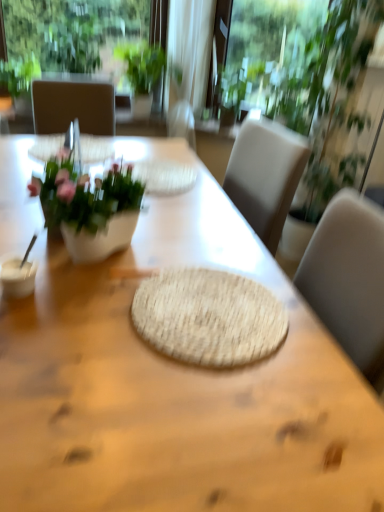
I want to click on natural woven placemat at center, so click(x=175, y=384).

The image size is (384, 512). What do you see at coordinates (85, 195) in the screenshot?
I see `white glossy vase at left` at bounding box center [85, 195].

Describe the element at coordinates (208, 317) in the screenshot. This screenshot has width=384, height=512. I see `natural woven mat at center` at that location.

Locate an element on the screen. This screenshot has width=384, height=512. transparent glass window screen at upper center is located at coordinates (270, 60).

What is the approximate width of green leafy plant at upper left, which ranks as the 3th houseplant in right-to-left order?

It is 14.29 inches.

What do you see at coordinates (146, 66) in the screenshot?
I see `green leafy plant at upper center, acting as the second houseplant starting from the left` at bounding box center [146, 66].

This screenshot has width=384, height=512. In order to click on green leafy plant at upper center, which is the second houseplant from right to left in this screenshot , I will do `click(146, 66)`.

The image size is (384, 512). I want to click on transparent glass window at upper center, so click(73, 33).

Can we say natural woven placemat at center lies outside natural woven mat at center?

Yes, natural woven placemat at center is outside of natural woven mat at center.

Where is `mat above the natural woven placemat at center (from the image's perspective)`? The width and height of the screenshot is (384, 512). mat above the natural woven placemat at center (from the image's perspective) is located at coordinates (208, 317).

Considering the sizes of natural woven placemat at center and natural woven mat at center in the image, is natural woven placemat at center bigger or smaller than natural woven mat at center?

In the image, natural woven placemat at center appears to be larger than natural woven mat at center.

Looking at this image, how many degrees apart are the facing directions of natural woven mat at center and green leafy plant at upper left, arranged as the first houseplant when viewed from the left?

90 degrees separate the facing orientations of natural woven mat at center and green leafy plant at upper left, arranged as the first houseplant when viewed from the left.

Considering the sizes of objects natural woven mat at center and green leafy plant at upper left, arranged as the first houseplant when viewed from the left, in the image provided, who is bigger, natural woven mat at center or green leafy plant at upper left, arranged as the first houseplant when viewed from the left,?

green leafy plant at upper left, arranged as the first houseplant when viewed from the left.

Based on the photo, are natural woven mat at center and green leafy plant at upper left, arranged as the first houseplant when viewed from the left, located far from each other?

Absolutely, natural woven mat at center is distant from green leafy plant at upper left, arranged as the first houseplant when viewed from the left.

Does point (151, 319) come in front of point (26, 63)?

That is True.

From the image's perspective, is transparent glass window at upper center on top of natural woven mat at center?

Yes.

Locate an element on the screen. window lying behind the natural woven mat at center is located at coordinates (73, 33).

Can you confirm if transparent glass window at upper center is smaller than natural woven mat at center?

Incorrect, transparent glass window at upper center is not smaller in size than natural woven mat at center.

Does point (47, 66) come farther from viewer compared to point (182, 322)?

Yes, it is behind point (182, 322).

I want to click on table in front of the transparent glass window screen at upper center, so click(x=175, y=384).

From the image's perspective, would you say transparent glass window screen at upper center is positioned over natural woven placemat at center?

Indeed, from the image's perspective, transparent glass window screen at upper center is shown above natural woven placemat at center.

Is point (288, 18) less distant than point (340, 360)?

No, it is not.

Who is smaller, transparent glass window screen at upper center or natural woven placemat at center?

transparent glass window screen at upper center.

Considering the sizes of transparent glass window at upper center and green leafy plant at upper center, which is the second houseplant from right to left, in the image, is transparent glass window at upper center bigger or smaller than green leafy plant at upper center, which is the second houseplant from right to left,?

transparent glass window at upper center is smaller than green leafy plant at upper center, which is the second houseplant from right to left.

From a real-world perspective, is transparent glass window at upper center on green leafy plant at upper center, acting as the second houseplant starting from the left?

Yes, from a real-world perspective, transparent glass window at upper center is above green leafy plant at upper center, acting as the second houseplant starting from the left.

From the image's perspective, is transparent glass window at upper center on green leafy plant at upper center, which is the second houseplant from right to left?

Yes, from the image's perspective, transparent glass window at upper center is over green leafy plant at upper center, which is the second houseplant from right to left.

Considering the positions of points (8, 57) and (127, 63), is point (8, 57) farther from camera compared to point (127, 63)?

No, it is not.

From the image's perspective, does green leafy plant at upper center, which is the second houseplant from right to left, appear lower than natural woven placemat at center?

No.

Locate an element on the screen. This screenshot has height=512, width=384. the 3rd houseplant behind the natural woven placemat at center, starting your count from the anchor is located at coordinates (146, 66).

What's the angular difference between green leafy plant at upper center, acting as the second houseplant starting from the left, and natural woven placemat at center's facing directions?

The angle between the facing direction of green leafy plant at upper center, acting as the second houseplant starting from the left, and the facing direction of natural woven placemat at center is 94.9 degrees.

Between transparent glass window screen at upper center and white glossy vase at left, which one has less height?

With less height is white glossy vase at left.

Is transparent glass window screen at upper center not inside white glossy vase at left?

Yes, transparent glass window screen at upper center is not within white glossy vase at left.

At what (x,y) coordinates should I click in order to perform the action: click on window screen on the right of white glossy vase at left. Please return your answer as a coordinate pair (x, y). Looking at the image, I should click on (270, 60).

Find the location of `mat that is on the left side of natural woven placemat at center`. mat that is on the left side of natural woven placemat at center is located at coordinates (208, 317).

The image size is (384, 512). Identify the location of houseplant that is the 1st object above the natural woven mat at center (from a real-world perspective). (19, 76).

From the image, which object appears to be farther from white glossy vase at left, green leafy plant at upper center, acting as the second houseplant starting from the left, or transparent glass window at upper center?

green leafy plant at upper center, acting as the second houseplant starting from the left, is further to white glossy vase at left.

Which object lies nearer to the anchor point green leafy plant at upper left, arranged as the first houseplant when viewed from the left, transparent glass window screen at upper center or white glossy vase at left?

transparent glass window screen at upper center.

Considering their positions, is green leafy plant at upper center, acting as the second houseplant starting from the left, positioned closer to green leafy plant at upper left, arranged as the first houseplant when viewed from the left, than green leafy plant at upper right, positioned as the 1th houseplant in right-to-left order?

green leafy plant at upper center, acting as the second houseplant starting from the left.

Estimate the real-world distances between objects in this image. Which object is closer to transparent glass window screen at upper center, green leafy plant at upper center, which is the second houseplant from right to left, or green leafy plant at upper right, which is the third houseplant in left-to-right order?

green leafy plant at upper right, which is the third houseplant in left-to-right order, lies closer to transparent glass window screen at upper center than the other object.

Based on the photo, when comparing their distances from green leafy plant at upper right, positioned as the 1th houseplant in right-to-left order, does green leafy plant at upper left, arranged as the first houseplant when viewed from the left, or natural woven placemat at center seem closer?

natural woven placemat at center is closer to green leafy plant at upper right, positioned as the 1th houseplant in right-to-left order.

Which object lies further to the anchor point green leafy plant at upper center, acting as the second houseplant starting from the left, transparent glass window screen at upper center or green leafy plant at upper left, which ranks as the 3th houseplant in right-to-left order?

green leafy plant at upper left, which ranks as the 3th houseplant in right-to-left order, is positioned further to the anchor green leafy plant at upper center, acting as the second houseplant starting from the left.

Looking at the image, which one is located closer to transparent glass window at upper center, transparent glass window screen at upper center or green leafy plant at upper left, arranged as the first houseplant when viewed from the left?

Based on the image, green leafy plant at upper left, arranged as the first houseplant when viewed from the left, appears to be nearer to transparent glass window at upper center.

Estimate the real-world distances between objects in this image. Which object is closer to natural woven placemat at center, green leafy plant at upper right, which is the third houseplant in left-to-right order, or transparent glass window at upper center?

The object closer to natural woven placemat at center is green leafy plant at upper right, which is the third houseplant in left-to-right order.

Locate an element on the screen. The width and height of the screenshot is (384, 512). flower located between natural woven mat at center and green leafy plant at upper center, which is the second houseplant from right to left, in the depth direction is located at coordinates (85, 195).

This screenshot has width=384, height=512. Find the location of `houseplant between transparent glass window at upper center and green leafy plant at upper right, positioned as the 1th houseplant in right-to-left order, from left to right`. houseplant between transparent glass window at upper center and green leafy plant at upper right, positioned as the 1th houseplant in right-to-left order, from left to right is located at coordinates (146, 66).

Find the location of a particular element. The height and width of the screenshot is (512, 384). houseplant between green leafy plant at upper left, arranged as the first houseplant when viewed from the left, and green leafy plant at upper right, which is the third houseplant in left-to-right order is located at coordinates (146, 66).

This screenshot has width=384, height=512. I want to click on houseplant between transparent glass window at upper center and transparent glass window screen at upper center in the horizontal direction, so click(146, 66).